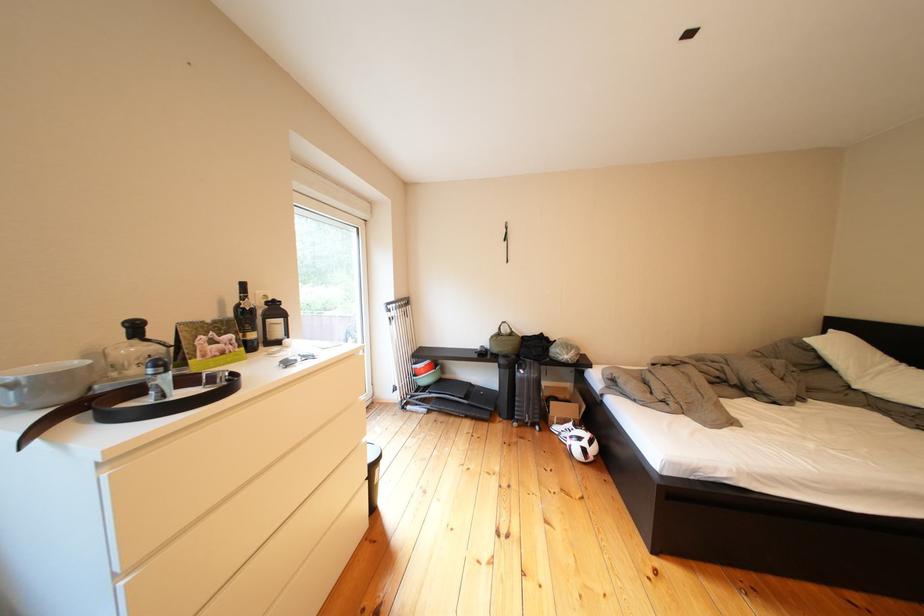
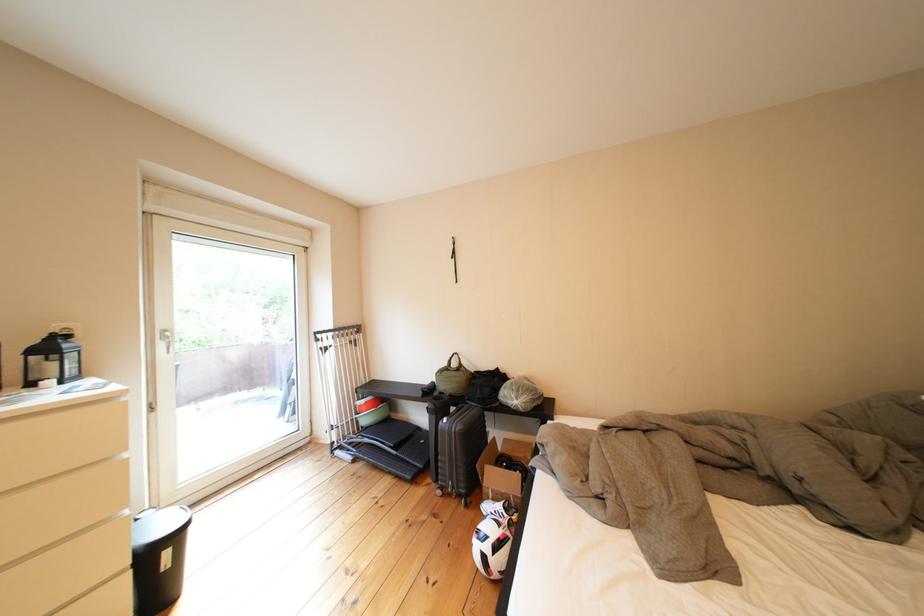
What movement of the cameraman would produce the second image?

The cameraman moved toward right, forward.